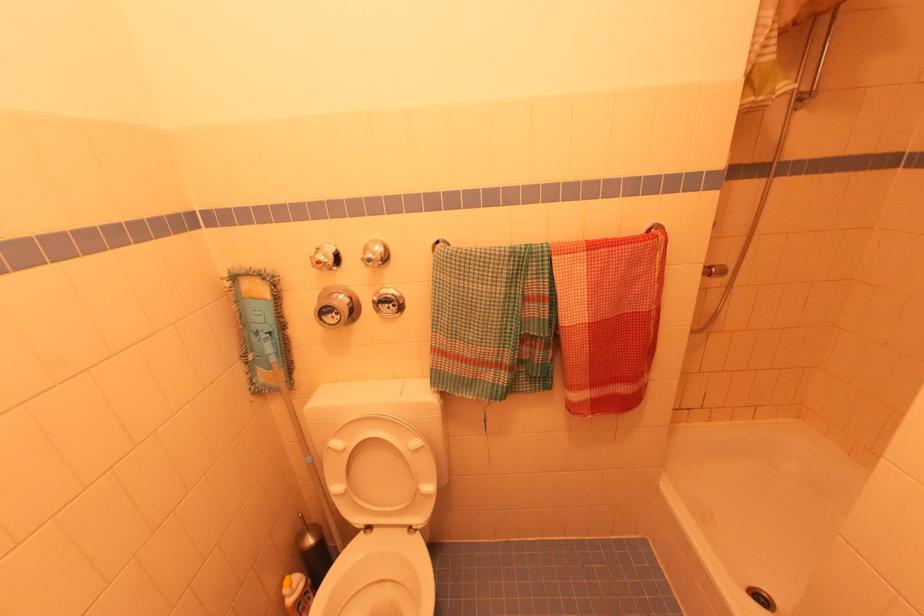
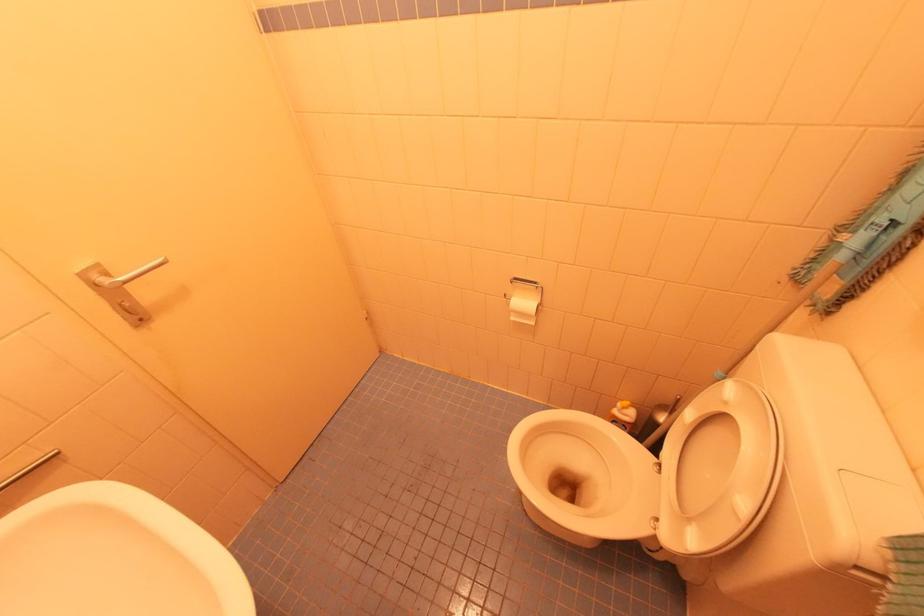
First-person continuous shooting, in which direction is the camera rotating?

The rotation direction of the camera is left-down.